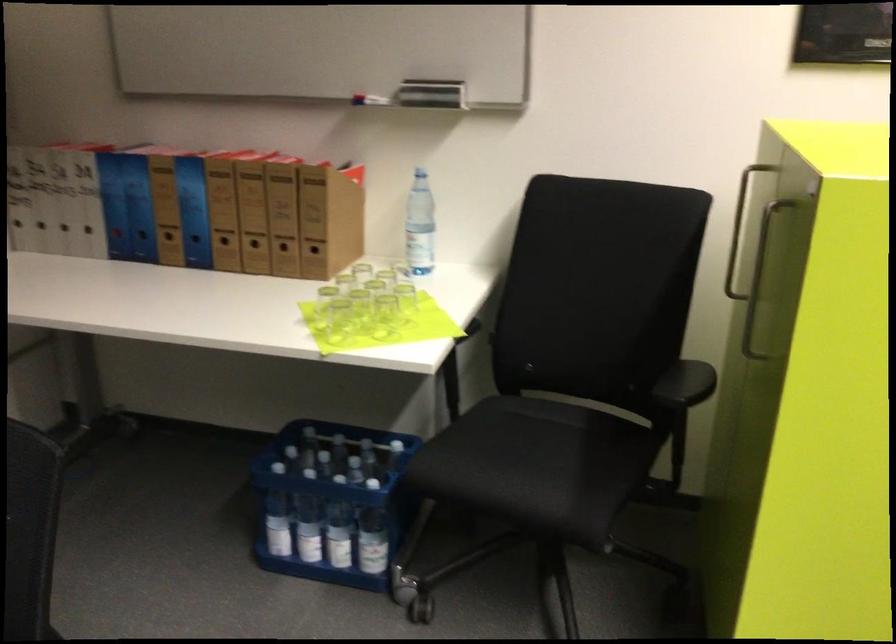
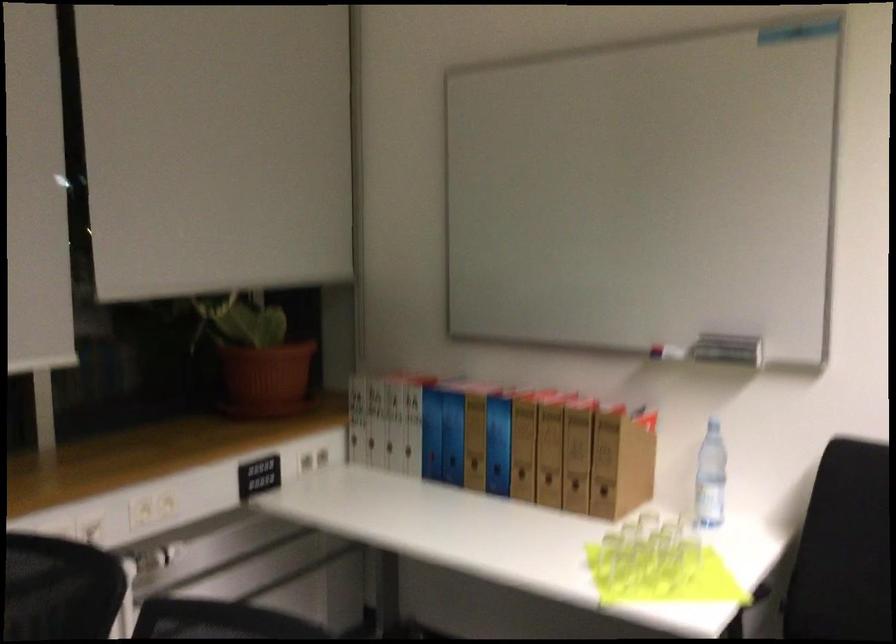
Question: How did the camera likely rotate?

Choices:
 (A) Left
 (B) Right
 (C) Up
 (D) Down

Answer: (A)